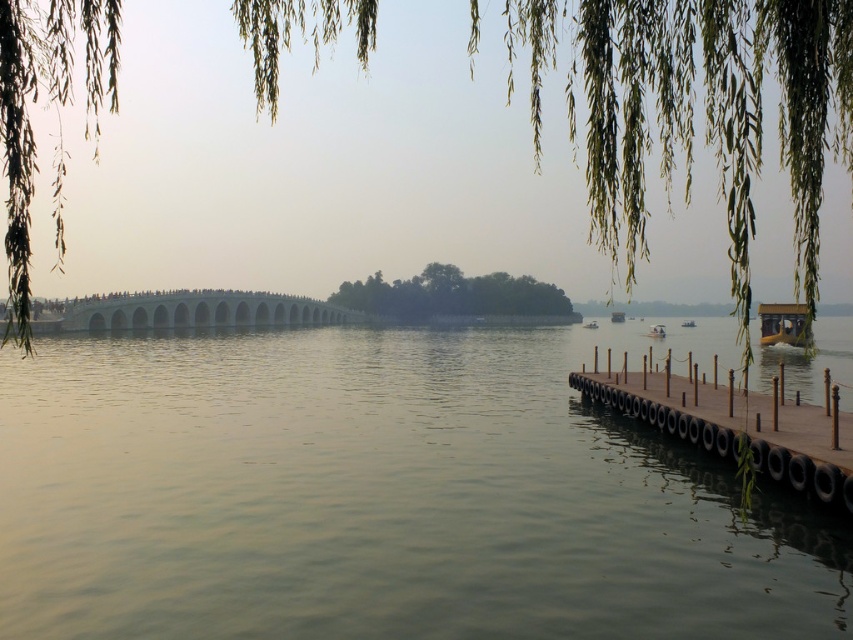
The height and width of the screenshot is (640, 853). What do you see at coordinates (695, 118) in the screenshot? I see `green leafy willow at upper left` at bounding box center [695, 118].

Can you confirm if green leafy willow at upper left is smaller than brown wooden dock at lower right?

No, green leafy willow at upper left is not smaller than brown wooden dock at lower right.

Locate an element on the screen. green leafy willow at upper left is located at coordinates (695, 118).

The image size is (853, 640). I want to click on green leafy willow at upper left, so [695, 118].

Can you confirm if brown wooden dock at lower right is smaller than white glossy boat at center?

Incorrect, brown wooden dock at lower right is not smaller in size than white glossy boat at center.

Which is in front, point (791, 454) or point (595, 324)?

Point (791, 454) is more forward.

You are a GUI agent. You are given a task and a screenshot of the screen. Output one action in this format:
    pyautogui.click(x=<x>, y=<y>)
    Task: Click on the brown wooden dock at lower right
    The width and height of the screenshot is (853, 640).
    Given the screenshot: What is the action you would take?
    pyautogui.click(x=738, y=428)

Who is higher up, green leafy island at center or wooden boat at center?

green leafy island at center is above.

Where is `green leafy island at center`? The height and width of the screenshot is (640, 853). green leafy island at center is located at coordinates (451, 294).

The width and height of the screenshot is (853, 640). What are the coordinates of `green leafy island at center` in the screenshot? It's located at (451, 294).